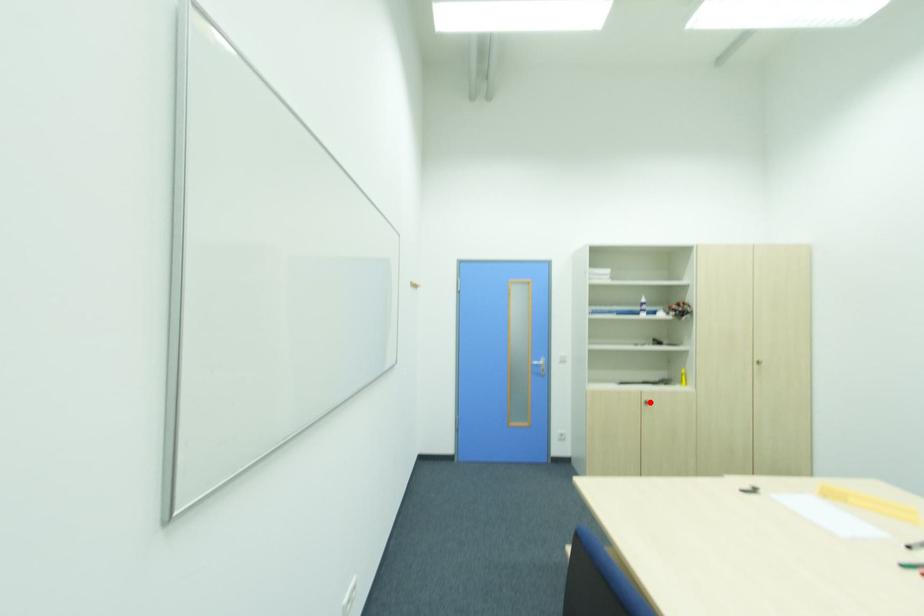
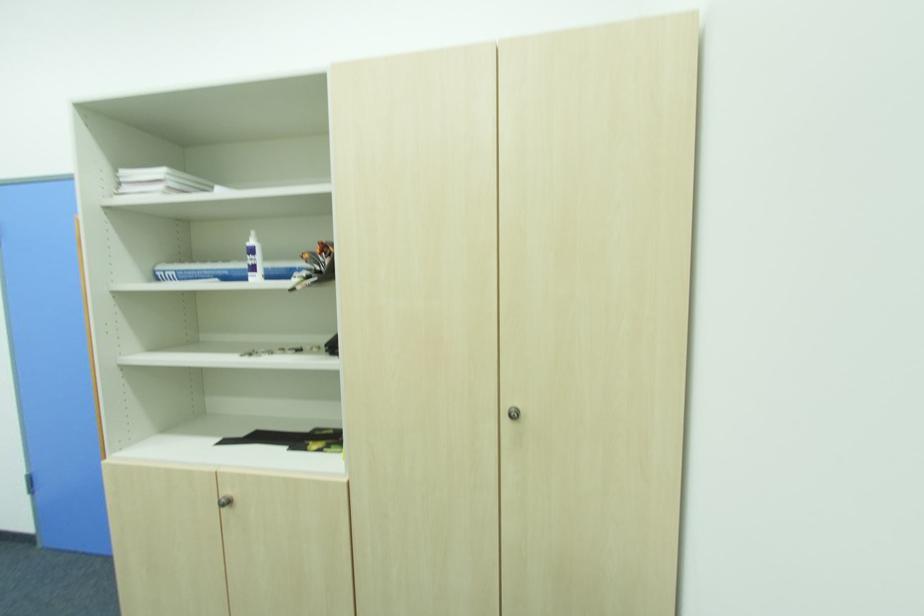
Question: A red point is marked in image1. In image2, is the corresponding 3D point closer to the camera or farther? Reply with the corresponding letter.

Choices:
 (A) The corresponding 3D point is closer.
 (B) The corresponding 3D point is farther.

Answer: (A)